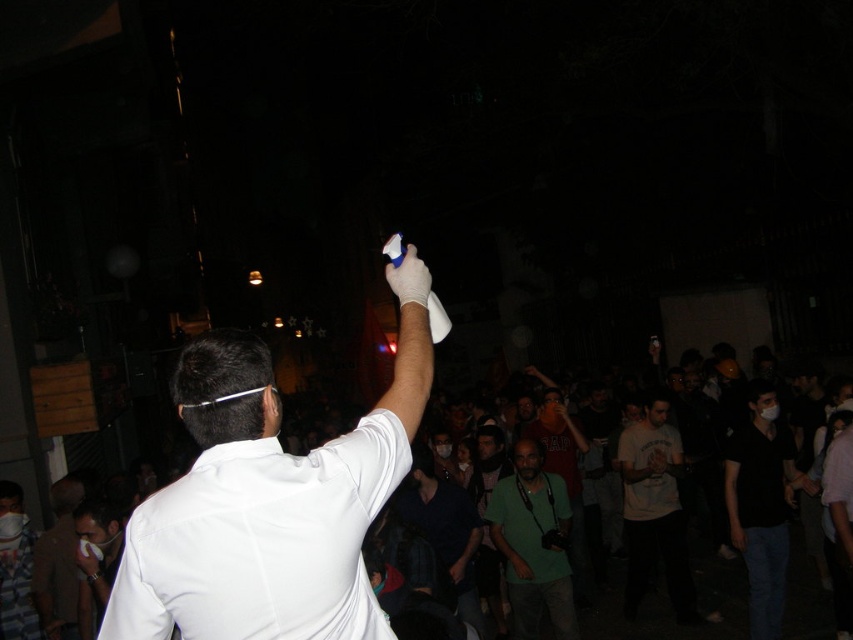
You are standing in the crowd at the event and want to hand the white matte game controller at upper center to the person wearing the green fabric shirt at center. Can you reach them directly without moving around others?

The green fabric shirt at center is closer to you than the white matte game controller at upper center, so you can reach the white matte game controller at upper center directly by extending your arm towards the person wearing the green fabric shirt at center.

What are the coordinates of the white matte shirt at upper center?

The white matte shirt at upper center is located at point (265, 506).